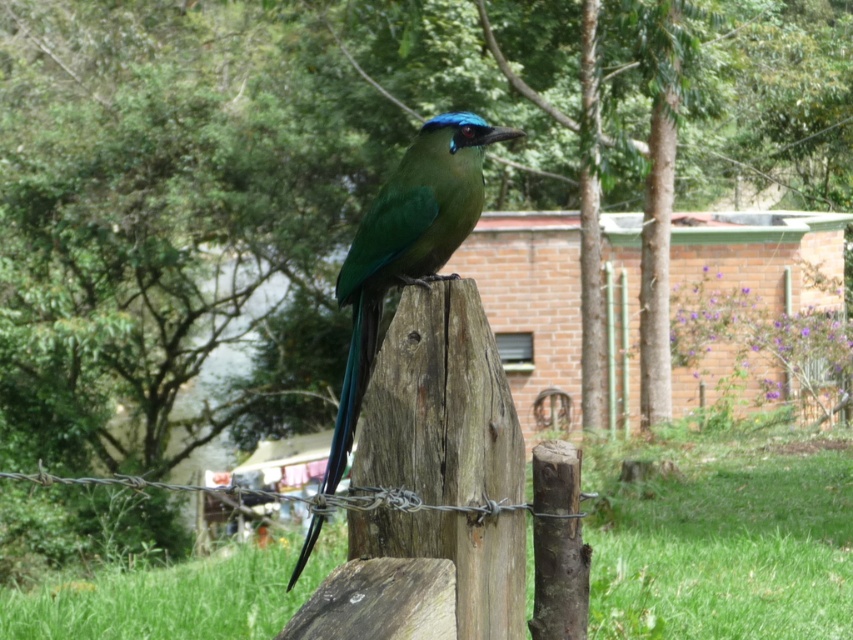
Question: Which point appears farthest from the camera in this image?

Choices:
 (A) (520, 433)
 (B) (447, 148)
 (C) (329, 499)

Answer: (B)

Question: Estimate the real-world distances between objects in this image. Which object is closer to the barbed wire at center?

Choices:
 (A) green glossy bird at center
 (B) weathered wood post at center

Answer: (B)

Question: Is weathered wood post at center behind green glossy bird at center?

Choices:
 (A) no
 (B) yes

Answer: (A)

Question: Which point is closer to the camera taking this photo?

Choices:
 (A) (498, 560)
 (B) (231, 496)
 (C) (424, 209)

Answer: (B)

Question: Can you confirm if weathered wood post at center is positioned to the right of green glossy bird at center?

Choices:
 (A) yes
 (B) no

Answer: (A)

Question: Is green glossy bird at center thinner than barbed wire at center?

Choices:
 (A) yes
 (B) no

Answer: (A)